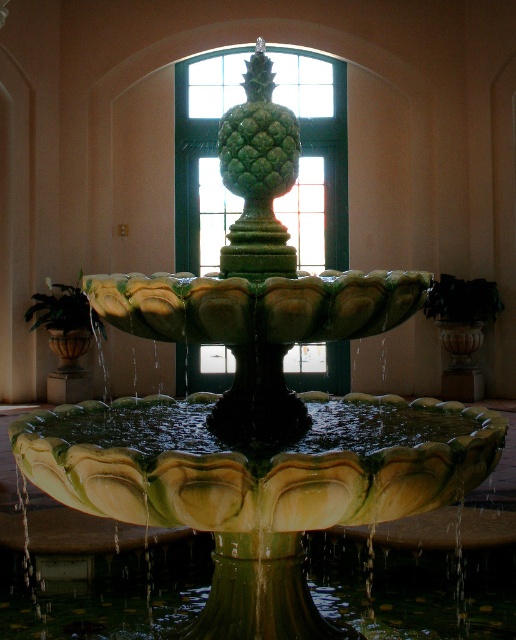
You are standing in the grand hall and want to touch both the green glass window at center and the green matte pineapple at center. Which one can you reach first without moving your feet?

The green glass window at center is closer to you than the green matte pineapple at center, so you can reach it first without moving your feet.

In the scene shown: You are standing in the grand hall and want to locate the green glass window at center. According to the coordinates provided, where should you look? Please provide the coordinates in the format of a point like point (x=316, y=157).

The green glass window at center is marked by point (x=316, y=157).